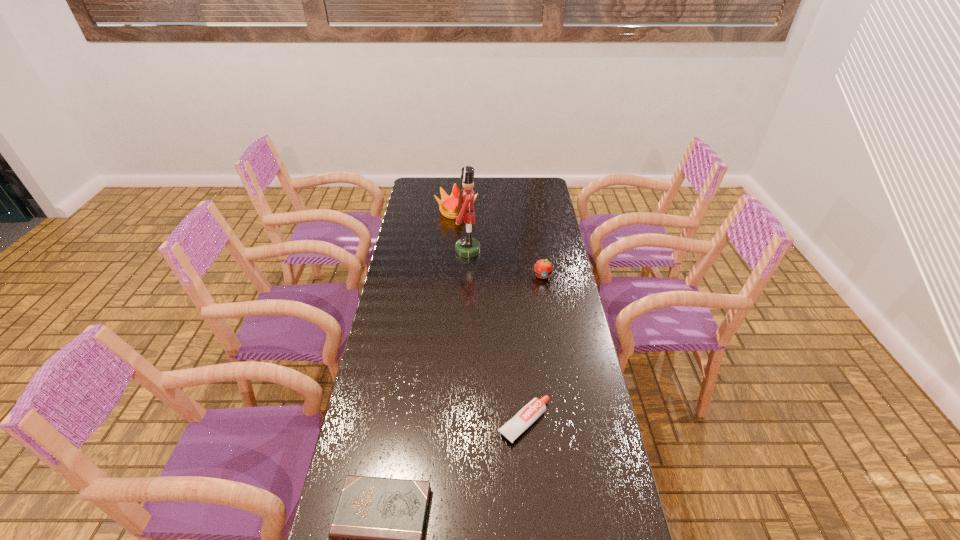
Locate an element on the screen. vacant space at the far left corner of the desktop is located at coordinates (413, 183).

Image resolution: width=960 pixels, height=540 pixels. In order to click on free space between the third farthest object and the nutcracker in this screenshot , I will do `click(505, 263)`.

The width and height of the screenshot is (960, 540). In order to click on vacant space that is in between the second nearest object and the crown in this screenshot , I will do `click(491, 316)`.

You are a GUI agent. You are given a task and a screenshot of the screen. Output one action in this format:
    pyautogui.click(x=<x>, y=<y>)
    Task: Click on the vacant area that lies between the second nearest object and the nutcracker
    The image size is (960, 540).
    Given the screenshot: What is the action you would take?
    pyautogui.click(x=496, y=336)

This screenshot has width=960, height=540. Find the location of `free spot between the third nearest object and the tallest object`. free spot between the third nearest object and the tallest object is located at coordinates point(505,263).

You are a GUI agent. You are given a task and a screenshot of the screen. Output one action in this format:
    pyautogui.click(x=<x>, y=<y>)
    Task: Click on the free space that is in between the second tallest object and the second shortest object
    
    Given the screenshot: What is the action you would take?
    pyautogui.click(x=491, y=316)

Where is `object that is the fourth closest to the fourth shortest object`? object that is the fourth closest to the fourth shortest object is located at coordinates (376, 537).

Identify which object is located as the second nearest to the tallest object. Please provide its 2D coordinates. Your answer should be formatted as a tuple, i.e. [(x, y)], where the tuple contains the x and y coordinates of a point satisfying the conditions above.

[(543, 268)]

Where is `vacant area in the image that satisfies the following two spatial constraints: 1. on the back side of the third nearest object; 2. on the front-facing side of the tallest object`? This screenshot has width=960, height=540. vacant area in the image that satisfies the following two spatial constraints: 1. on the back side of the third nearest object; 2. on the front-facing side of the tallest object is located at coordinates (538, 251).

I want to click on vacant region that satisfies the following two spatial constraints: 1. on the back side of the toothpaste; 2. on the front-facing side of the fourth nearest object, so click(x=510, y=251).